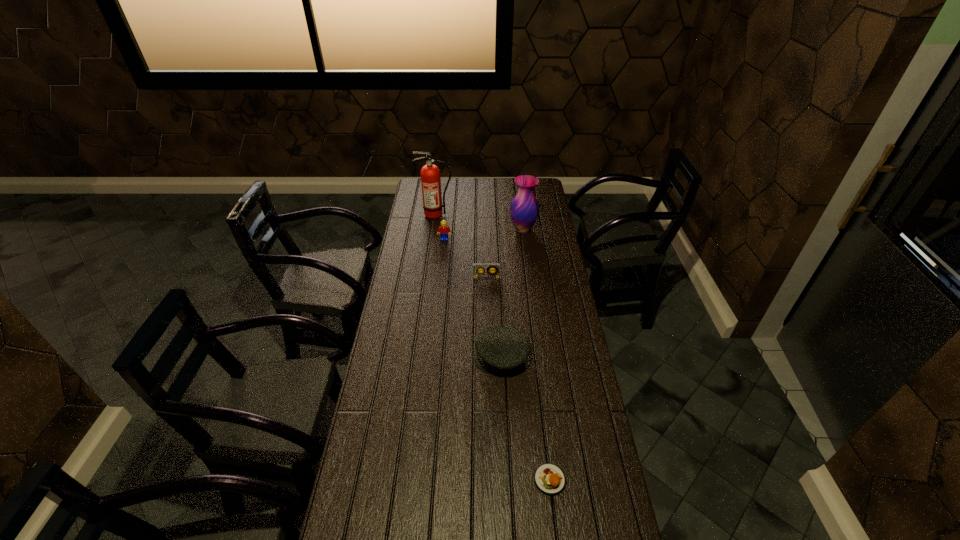
Image resolution: width=960 pixels, height=540 pixels. What are the coordinates of `vacant space located 0.370m on the handle side of the fire extinguisher` in the screenshot? It's located at (429, 265).

Locate an element on the screen. vacant space located 0.290m on the back of the fifth shortest object is located at coordinates (518, 193).

This screenshot has height=540, width=960. In order to click on vacant space located on the front-facing side of the Lego in this screenshot , I will do `click(442, 271)`.

You are a GUI agent. You are given a task and a screenshot of the screen. Output one action in this format:
    pyautogui.click(x=<x>, y=<y>)
    Task: Click on the free space located 0.270m on the front-facing side of the fifth farthest object
    The height and width of the screenshot is (540, 960).
    Given the screenshot: What is the action you would take?
    pyautogui.click(x=400, y=357)

Where is `blank space located on the front-facing side of the fifth farthest object`? This screenshot has height=540, width=960. blank space located on the front-facing side of the fifth farthest object is located at coordinates (441, 357).

In order to click on free location located on the front-facing side of the fifth farthest object in this screenshot , I will do `click(417, 357)`.

Find the location of `vacant area situated 0.400m at the front of the fourth farthest object with visible reels`. vacant area situated 0.400m at the front of the fourth farthest object with visible reels is located at coordinates (488, 347).

Locate an element on the screen. This screenshot has width=960, height=540. vacant space located on the left of the shortest object is located at coordinates (496, 480).

This screenshot has width=960, height=540. I want to click on object that is at the left edge, so click(430, 174).

This screenshot has width=960, height=540. In order to click on vase that is at the right edge in this screenshot , I will do pyautogui.click(x=524, y=210).